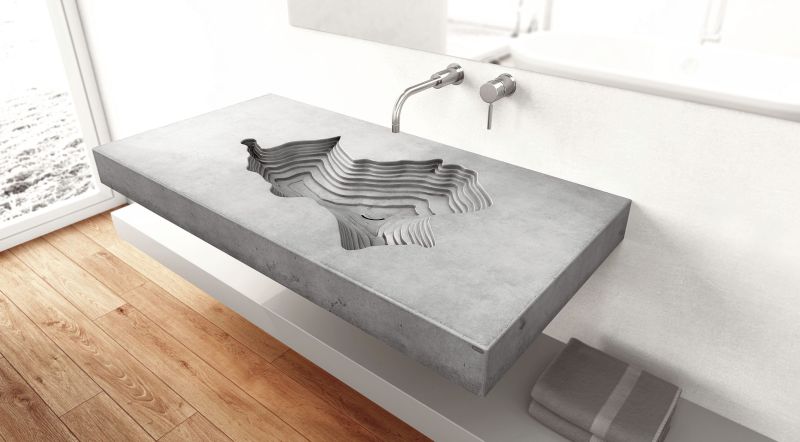
At what (x,y) coordinates should I click in order to perform the action: click on side edge of sink. Please return your answer as a coordinate pair (x, y). Looking at the image, I should click on tap(540, 313).